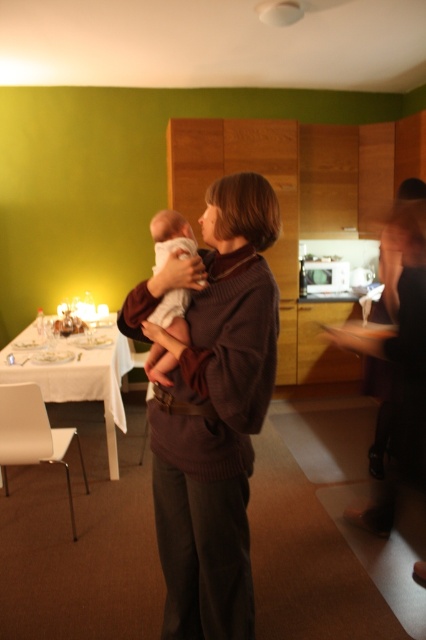
Can you confirm if brown sweater at center is wider than white soft baby at center?

Indeed, brown sweater at center has a greater width compared to white soft baby at center.

Does brown sweater at center lie behind white soft baby at center?

No, brown sweater at center is closer to the viewer.

You are a GUI agent. You are given a task and a screenshot of the screen. Output one action in this format:
    pyautogui.click(x=<x>, y=<y>)
    Task: Click on the brown sweater at center
    This screenshot has width=426, height=640.
    Given the screenshot: What is the action you would take?
    pyautogui.click(x=213, y=410)

You are a GUI agent. You are given a task and a screenshot of the screen. Output one action in this format:
    pyautogui.click(x=<x>, y=<y>)
    Task: Click on the brown sweater at center
    The width and height of the screenshot is (426, 640).
    Given the screenshot: What is the action you would take?
    pyautogui.click(x=213, y=410)

Is white cloth table at left thinner than white soft baby at center?

No.

Is white cloth table at left below white soft baby at center?

Correct, white cloth table at left is located below white soft baby at center.

Where is `white cloth table at left`? white cloth table at left is located at coordinates (80, 380).

Is brown sweater at center shorter than white cloth table at left?

In fact, brown sweater at center may be taller than white cloth table at left.

Describe the element at coordinates (213, 410) in the screenshot. I see `brown sweater at center` at that location.

I want to click on brown sweater at center, so click(x=213, y=410).

Identify the location of brown sweater at center. (213, 410).